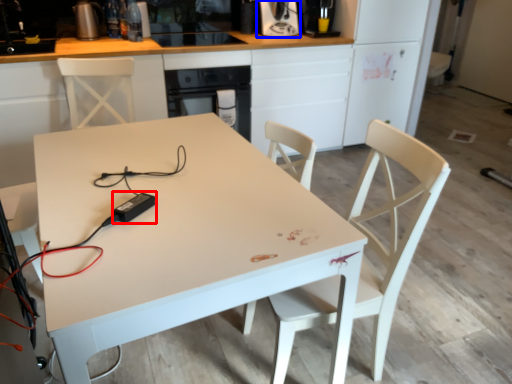
Question: Which of the following is the closest to the observer, appliance (highlighted by a red box) or coffee machine (highlighted by a blue box)?

Choices:
 (A) appliance
 (B) coffee machine

Answer: (A)